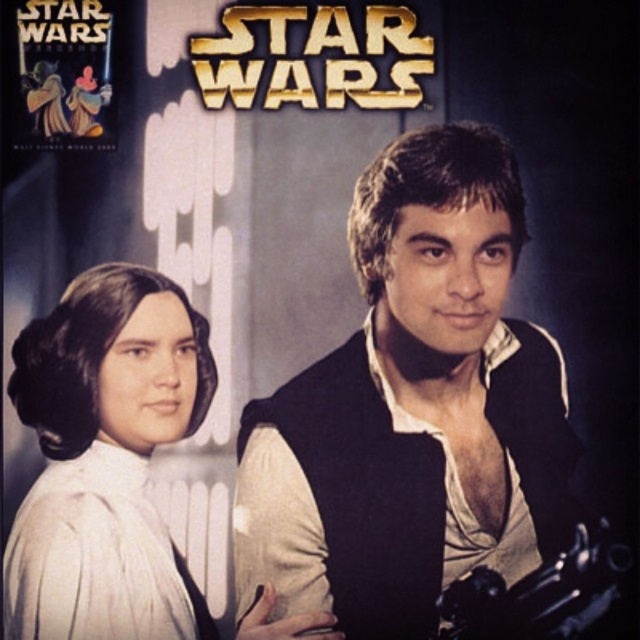
You are a costume designer trying to determine which object in the image takes up more space. You see the matte black vest at center and the polished metal gun at lower right. Which one is larger in size?

The matte black vest at center is bigger than the polished metal gun at lower right, so the matte black vest at center takes up more space.

You are a photographer setting up for a Star Wars themed photoshoot. You need to position a light source so that it illuminates both the white satin dress at left and the polished metal gun at lower right equally. Based on their positions, where should you place the light source relative to the two objects?

The white satin dress at left is above the polished metal gun at lower right. To illuminate both equally, the light source should be placed directly in between them, positioned centrally above the polished metal gun at lower right so that the light reaches both objects evenly.

From the picture: You are designing a display for a Star Wars exhibit and need to place the matte black vest at center and the white satin dress at left. Given their sizes, which one should be placed in a larger display case?

The matte black vest at center is bigger than the white satin dress at left, so it should be placed in a larger display case.